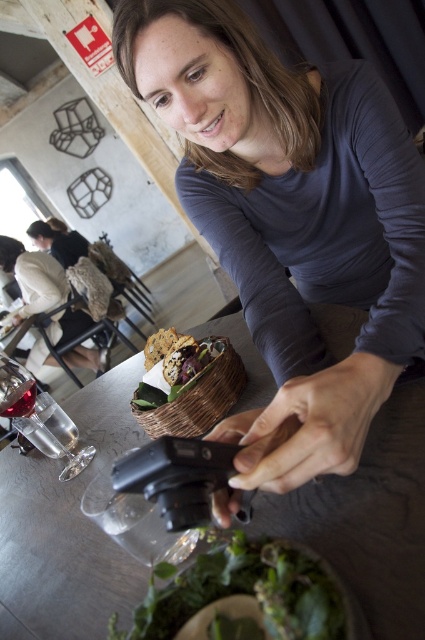
You are a photographer standing 1 meter away from the table in the dining scene. You want to capture a closeup shot of the brown woven basket at center. Can you reach it without moving closer than your current position?

The brown woven basket at center is 68.18 centimeters away from the viewer. Since you are currently 1 meter away, which is 100 centimeters, you can reach it without moving closer because the basket is within your reach range.

In the dining scene, there is a green leafy salad at lower center and a translucent glass wine glass at lower left. Which object is positioned to the right of the other?

The green leafy salad at lower center is positioned to the right of the translucent glass wine glass at lower left.

You are a waiter in a restaurant and need to place a new dish between the green leafy salad at lower center and the translucent glass wine glass at lower left. Can you fit it there?

The green leafy salad at lower center is located below the translucent glass wine glass at lower left, so there is space between them to place the new dish.